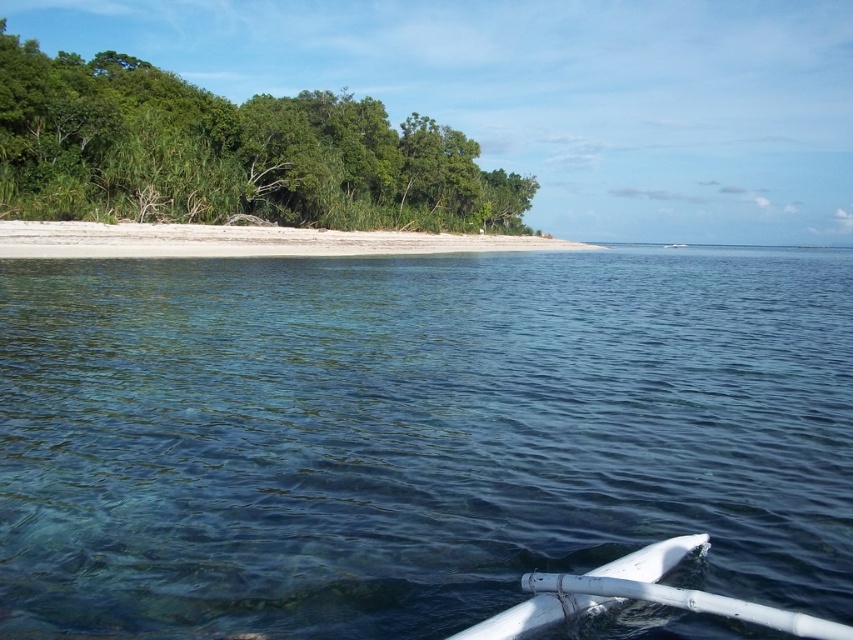
Question: Can you confirm if clear blue water at center is positioned to the right of white sand beach at center?

Choices:
 (A) yes
 (B) no

Answer: (A)

Question: Does clear blue water at center have a smaller size compared to white sand beach at center?

Choices:
 (A) no
 (B) yes

Answer: (B)

Question: Which point appears closest to the camera in this image?

Choices:
 (A) (467, 168)
 (B) (85, 228)

Answer: (B)

Question: Among these points, which one is nearest to the camera?

Choices:
 (A) (714, 605)
 (B) (270, 96)
 (C) (44, 252)
 (D) (51, 518)

Answer: (A)

Question: Among these points, which one is nearest to the camera?

Choices:
 (A) (148, 394)
 (B) (271, 234)
 (C) (38, 180)
 (D) (677, 548)

Answer: (D)

Question: Observing the image, what is the correct spatial positioning of green leafy trees at left in reference to white sand beach at center?

Choices:
 (A) right
 (B) left

Answer: (B)